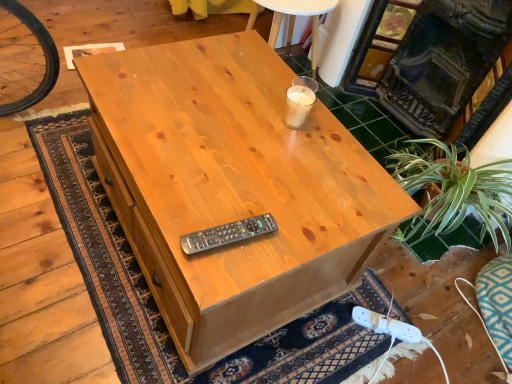
The image size is (512, 384). What are the coordinates of `vacant area on the back side of white plastic plug at lower right` in the screenshot? It's located at (383, 301).